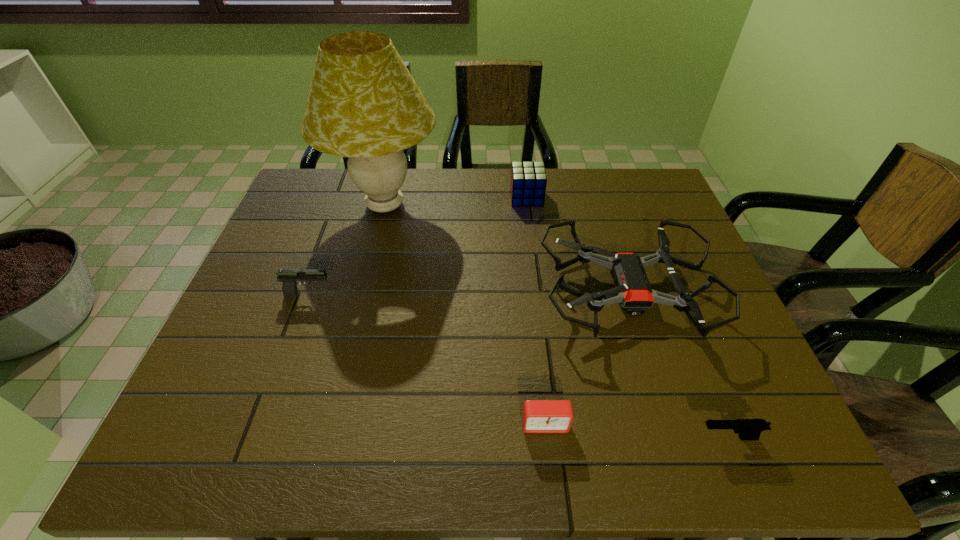
Locate an element on the screen. vacant point at the right edge is located at coordinates (679, 346).

I want to click on vacant area at the far left corner of the desktop, so click(x=316, y=174).

What are the coordinates of `vacant region at the far right corner of the desktop` in the screenshot? It's located at (632, 201).

I want to click on free space between the cube and the nearer pistol, so click(x=627, y=318).

Find the location of a particular element. This screenshot has width=960, height=540. vacant point located between the lampshade and the cube is located at coordinates (456, 201).

Where is `empty space that is in between the alarm clock and the right pistol`? empty space that is in between the alarm clock and the right pistol is located at coordinates (636, 430).

At what (x,y) coordinates should I click in order to perform the action: click on vacant point located between the nearer pistol and the cube. Please return your answer as a coordinate pair (x, y). This screenshot has width=960, height=540. Looking at the image, I should click on (627, 318).

Locate an element on the screen. This screenshot has height=540, width=960. free spot between the tallest object and the drone is located at coordinates (506, 249).

Find the location of `free area in between the alarm clock and the right pistol`. free area in between the alarm clock and the right pistol is located at coordinates (636, 430).

Where is `free space between the cube and the tallest object`? The image size is (960, 540). free space between the cube and the tallest object is located at coordinates (456, 201).